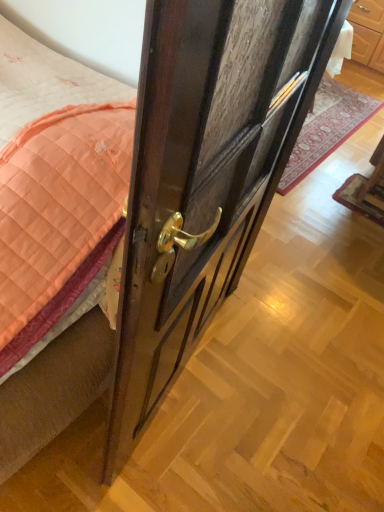
Question: Is dark wood door at center oriented towards wooden door handle at center?

Choices:
 (A) no
 (B) yes

Answer: (A)

Question: From a real-world perspective, is dark wood door at center below wooden door handle at center?

Choices:
 (A) yes
 (B) no

Answer: (B)

Question: Considering the relative positions of dark wood door at center and wooden door handle at center in the image provided, is dark wood door at center to the right of wooden door handle at center from the viewer's perspective?

Choices:
 (A) yes
 (B) no

Answer: (B)

Question: From the image's perspective, does dark wood door at center appear lower than wooden door handle at center?

Choices:
 (A) no
 (B) yes

Answer: (B)

Question: Considering the relative positions of dark wood door at center and wooden door handle at center in the image provided, is dark wood door at center in front of wooden door handle at center?

Choices:
 (A) no
 (B) yes

Answer: (B)

Question: From the image's perspective, is dark wood door at center positioned above or below wooden chair at lower right?

Choices:
 (A) above
 (B) below

Answer: (B)

Question: Looking at the image, does dark wood door at center seem bigger or smaller compared to wooden chair at lower right?

Choices:
 (A) big
 (B) small

Answer: (A)

Question: From a real-world perspective, relative to wooden chair at lower right, is dark wood door at center vertically above or below?

Choices:
 (A) below
 (B) above

Answer: (B)

Question: From their relative heights in the image, would you say dark wood door at center is taller or shorter than wooden chair at lower right?

Choices:
 (A) tall
 (B) short

Answer: (A)

Question: Is wooden door handle at center taller or shorter than dark wood door at center?

Choices:
 (A) short
 (B) tall

Answer: (A)

Question: Looking at the image, does wooden door handle at center seem bigger or smaller compared to dark wood door at center?

Choices:
 (A) big
 (B) small

Answer: (B)

Question: Visually, is wooden door handle at center positioned to the left or to the right of dark wood door at center?

Choices:
 (A) right
 (B) left

Answer: (A)

Question: From the image's perspective, relative to dark wood door at center, is wooden door handle at center above or below?

Choices:
 (A) above
 (B) below

Answer: (A)

Question: Is point (355, 208) positioned closer to the camera than point (281, 111)?

Choices:
 (A) farther
 (B) closer

Answer: (A)

Question: Based on their positions, is wooden chair at lower right located to the left or right of dark wood door at center?

Choices:
 (A) left
 (B) right

Answer: (B)